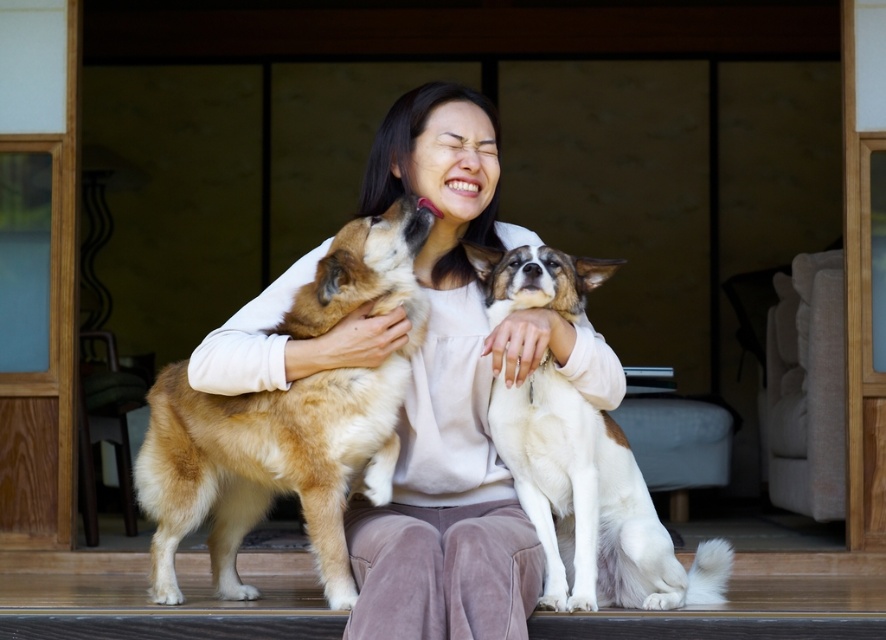
You are a photographer standing in front of the scene. You want to focus on the point that is closer to you. Which point should you choose between point (x=184, y=428) and point (x=568, y=456)?

Point (x=184, y=428) is further to the camera than point (x=568, y=456). Therefore, to focus on the point closer to you, you should choose point (x=568, y=456).

You are a delivery person trying to place a small package between the smooth beige sweater at center and the golden fur dog at center. The package is 12 inches long. Can you fit it there?

The distance between the smooth beige sweater at center and the golden fur dog at center is 10.00 inches. Since the package is 12 inches long, it cannot fit in the space provided.

From the picture: You are a photographer trying to capture a closeup of the golden fur dog at center and the white fur dog at center. Since you can only focus on one dog at a time, which dog should you focus on first if you want to ensure both are in focus without moving the camera?

The golden fur dog at center is located above the white fur dog at center, so you should focus on the golden fur dog at center first since it is closer to the camera, allowing the white fur dog at center to fall into the depth of field range.